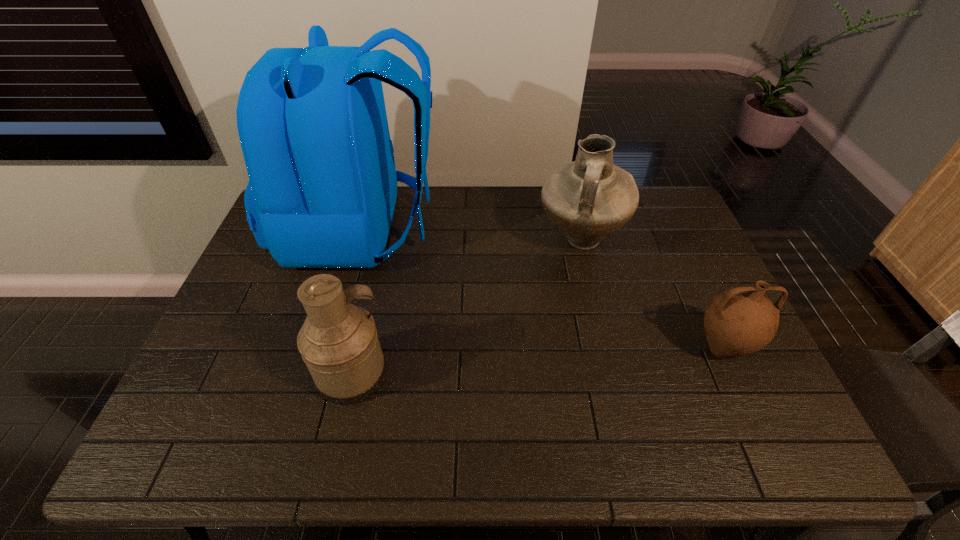
You are a GUI agent. You are given a task and a screenshot of the screen. Output one action in this format:
    pyautogui.click(x=<x>, y=<y>)
    Task: Click on the tallest object
    The width and height of the screenshot is (960, 540).
    Given the screenshot: What is the action you would take?
    pyautogui.click(x=312, y=123)

The height and width of the screenshot is (540, 960). Find the location of `the farthest pitcher`. the farthest pitcher is located at coordinates (588, 199).

The image size is (960, 540). I want to click on the second pitcher from left to right, so click(x=588, y=199).

Image resolution: width=960 pixels, height=540 pixels. Find the location of `the leftmost pitcher`. the leftmost pitcher is located at coordinates (338, 342).

Locate an element on the screen. the rightmost object is located at coordinates (739, 321).

Find the location of `the shortest pitcher`. the shortest pitcher is located at coordinates (739, 321).

This screenshot has width=960, height=540. I want to click on vacant area situated 0.110m on the back of the backpack, so click(x=473, y=230).

At what (x,y) coordinates should I click in order to perform the action: click on vacant space located 0.190m on the handle side of the third object from left to right. Please return your answer as a coordinate pair (x, y). This screenshot has height=540, width=960. Looking at the image, I should click on (599, 321).

Identify the location of free space located on the back of the leftmost pitcher. This screenshot has height=540, width=960. (369, 305).

What are the coordinates of `free region located 0.270m on the back of the shortest object` in the screenshot? It's located at (680, 257).